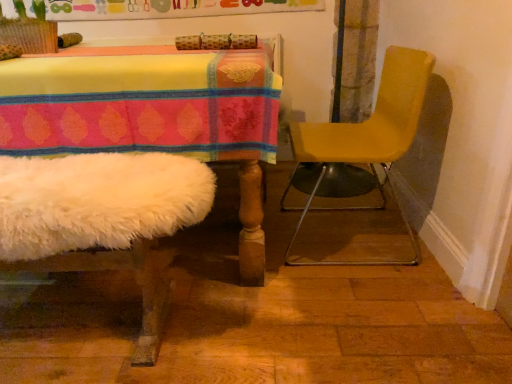
You are a GUI agent. You are given a task and a screenshot of the screen. Output one action in this format:
    pyautogui.click(x=<x>, y=<y>)
    Task: Click on the free location in front of matte yellow chair at right
    
    Given the screenshot: What is the action you would take?
    pyautogui.click(x=359, y=304)